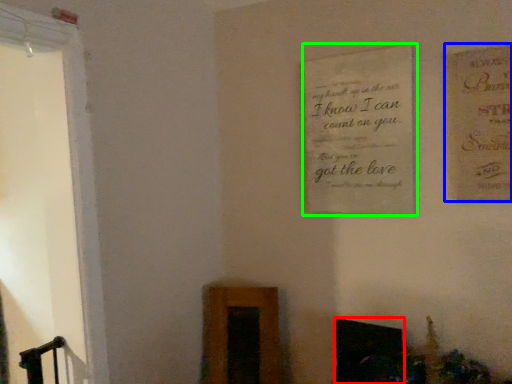
Question: Which is nearer to the fireplace (highlighted by a red box)? postcard (highlighted by a blue box) or plaque (highlighted by a green box).

Choices:
 (A) postcard
 (B) plaque

Answer: (B)